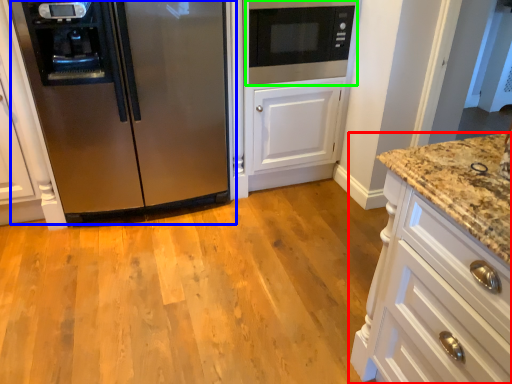
Question: Estimate the real-world distances between objects in this image. Which object is closer to cabinetry (highlighted by a red box), refrigerator (highlighted by a blue box) or microwave oven (highlighted by a green box)?

Choices:
 (A) refrigerator
 (B) microwave oven

Answer: (B)